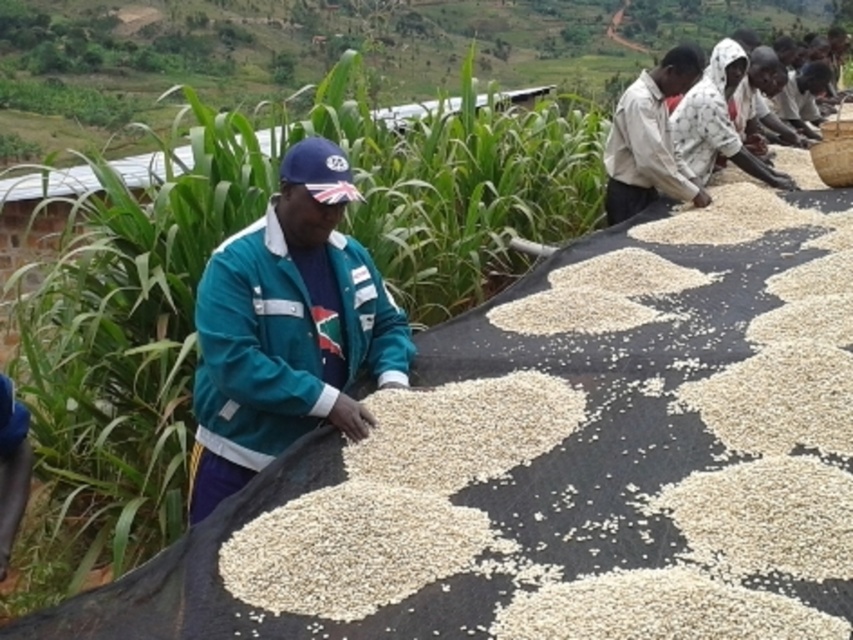
You are a photographer trying to capture a photo of the teal fabric jacket at center and the light brown cotton shirt at upper right. Which one will appear larger in the photo?

The teal fabric jacket at center appears larger in the photo because it is closer to the camera than the light brown cotton shirt at upper right.

In the rural scene where grains are being dried on tarps, you notice two people wearing distinct clothing. The first person is wearing a teal fabric jacket at center, and the second is wearing a light brown cotton shirt at upper right. From your perspective, which clothing item is positioned more to the left?

The teal fabric jacket at center is positioned to the left of the light brown cotton shirt at upper right, so the teal fabric jacket at center is more to the left.

You are a photographer capturing this rural scene. You notice the teal fabric jacket at center and the light brown cotton shirt at upper right. Which clothing item is positioned lower in the image?

The teal fabric jacket at center is located below the light brown cotton shirt at upper right, so the teal fabric jacket at center is positioned lower in the image.